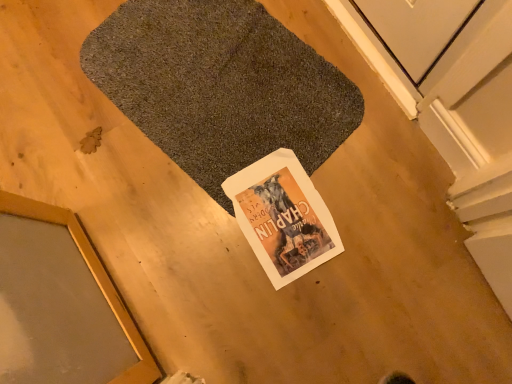
You are a GUI agent. You are given a task and a screenshot of the screen. Output one action in this format:
    pyautogui.click(x=<x>, y=<y>)
    Task: Click on the free point below white paper magazine at center (from a real-world perspective)
    
    Given the screenshot: What is the action you would take?
    pyautogui.click(x=298, y=230)